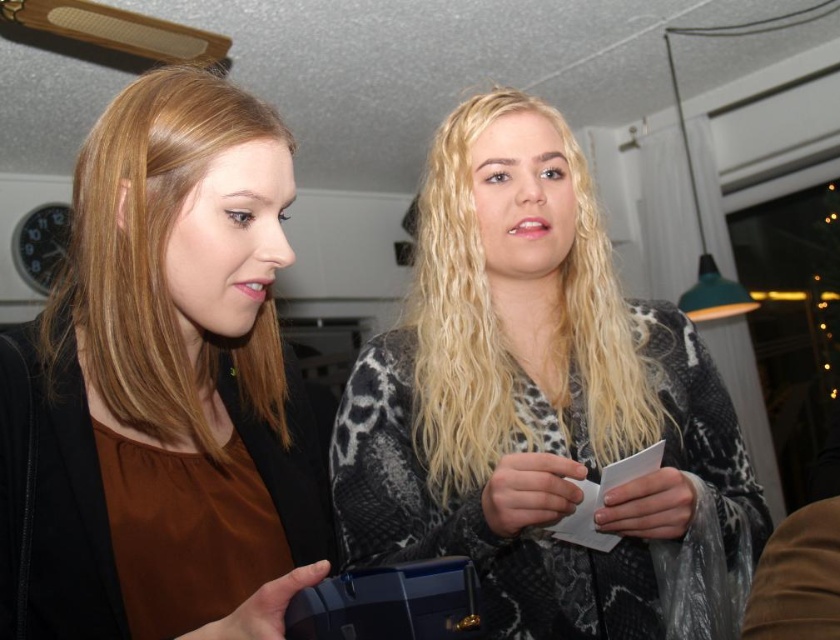
Identify the location of leopard print sweater at center. The width and height of the screenshot is (840, 640). (542, 406).

Locate an element on the screen. leopard print sweater at center is located at coordinates (542, 406).

How far apart are leopard print sweater at center and blondehair texturehair at center?

They are 1.68 inches apart.

Locate an element on the screen. leopard print sweater at center is located at coordinates (542, 406).

In order to click on leopard print sweater at center in this screenshot , I will do `click(542, 406)`.

Does brown matte shirt at left appear on the right side of blondehair texturehair at center?

No, brown matte shirt at left is not to the right of blondehair texturehair at center.

Where is `brown matte shirt at left`? brown matte shirt at left is located at coordinates click(x=161, y=388).